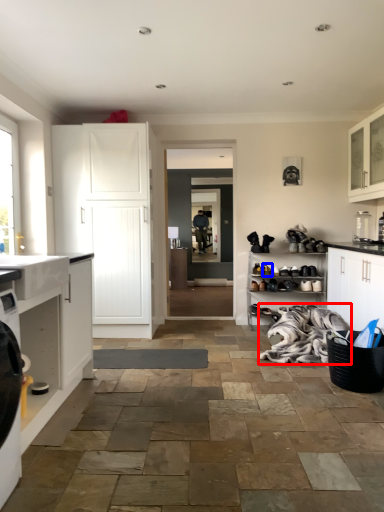
Question: Among these objects, which one is nearest to the camera, material (highlighted by a red box) or shoe (highlighted by a blue box)?

Choices:
 (A) material
 (B) shoe

Answer: (A)